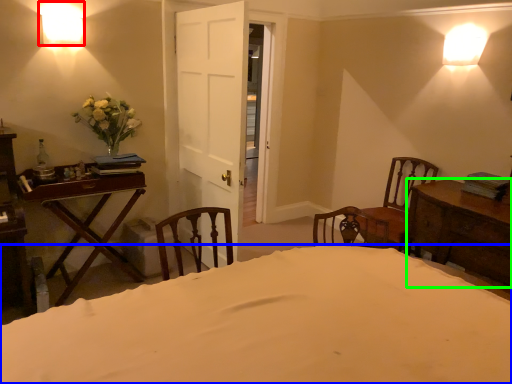
Question: Considering the real-world distances, which object is farthest from lamp (highlighted by a red box)? bed (highlighted by a blue box) or table (highlighted by a green box)?

Choices:
 (A) bed
 (B) table

Answer: (B)